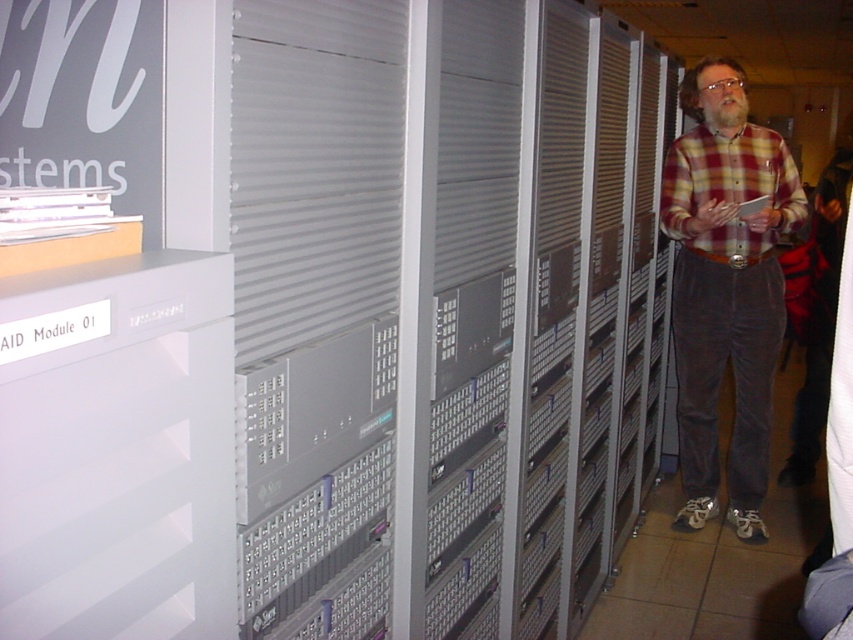
Question: Considering the relative positions of plaid flannel shirt at center and plaid cotton shirt at right in the image provided, where is plaid flannel shirt at center located with respect to plaid cotton shirt at right?

Choices:
 (A) below
 (B) above

Answer: (A)

Question: Does plaid flannel shirt at center appear over plaid cotton shirt at right?

Choices:
 (A) no
 (B) yes

Answer: (A)

Question: Which point is closer to the camera?

Choices:
 (A) (769, 248)
 (B) (695, 323)

Answer: (A)

Question: Which point is farther from the camera taking this photo?

Choices:
 (A) (694, 330)
 (B) (747, 189)

Answer: (A)

Question: In this image, where is plaid flannel shirt at center located relative to plaid cotton shirt at right?

Choices:
 (A) left
 (B) right

Answer: (A)